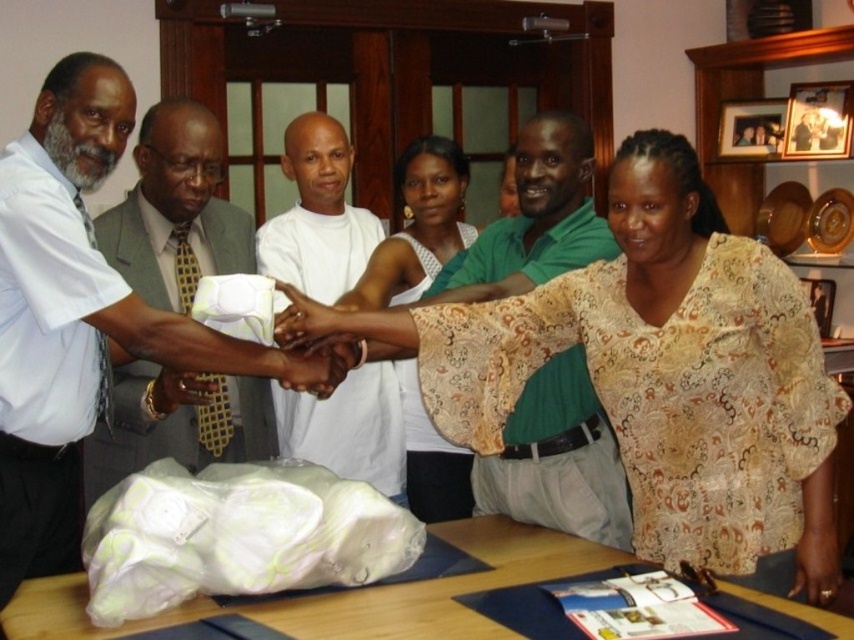
You are organizing a small gathering and need to determine if the green matte shirt at center can be placed on the wooden table at lower center without overhanging. Based on the scene description, can it fit?

The green matte shirt at center has a lesser width compared to the wooden table at lower center, so it can fit on the table without overhanging.

You are a photographer standing in front of the scene. You need to capture a photo where the white fabric at lower left and the green matte shirt at center are both visible. Which object should be placed on the left side of the frame to ensure both are visible?

The white fabric at lower left should be placed on the left side of the frame because it is already positioned on the left side of the green matte shirt at center, ensuring both can be captured together.